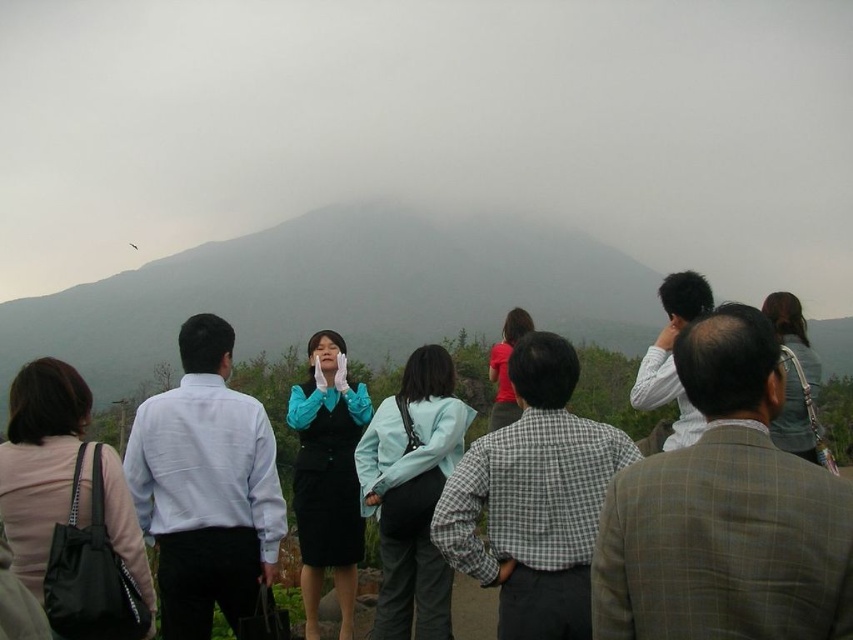
You are a hiker who wants to take a photo of the foggy mountain at center from the position of the red fabric shirt at center. Given that your camera has a maximum focus range of 120 meters, will you be able to capture the mountain clearly?

The foggy mountain at center is 124.23 meters away from the red fabric shirt at center. Since your camera can only focus up to 120 meters, you won

You are standing at the base of the mountain in the image and want to reach the point marked as point (392, 339). If your walking speed is 5 km per hour, how long will it take you to reach that point?

The distance to point (392, 339) is 96.69 meters. Converting meters to kilometers, it is 0.09669 km. At a walking speed of 5 km per hour, the time required is 0.09669 km divided by 5 km per hour, which equals approximately 0.0193 hours. Multiplying by 60 minutes gives about 1.16 minutes, so roughly 1 minute and 7 seconds.

You are a photographer trying to capture a group photo of the matte blue suit at center and the dark gray fabric jacket at upper right. The camera you have can focus on subjects within 30 feet. Will you be able to capture both subjects clearly in one shot?

The distance between the matte blue suit at center and the dark gray fabric jacket at upper right is 36.90 feet, which exceeds the camera focus range of 30 feet. Therefore, you cannot capture both subjects clearly in one shot.